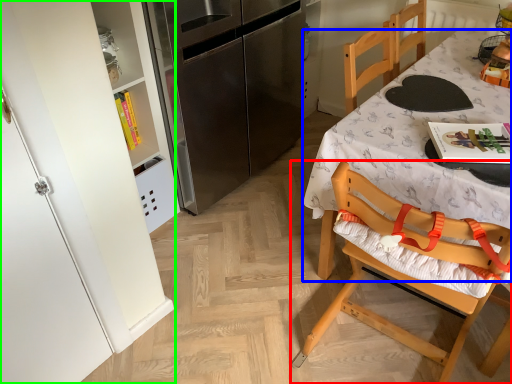
Question: Estimate the real-world distances between objects in this image. Which object is farther from chair (highlighted by a red box), desk (highlighted by a blue box) or cabinetry (highlighted by a green box)?

Choices:
 (A) desk
 (B) cabinetry

Answer: (B)